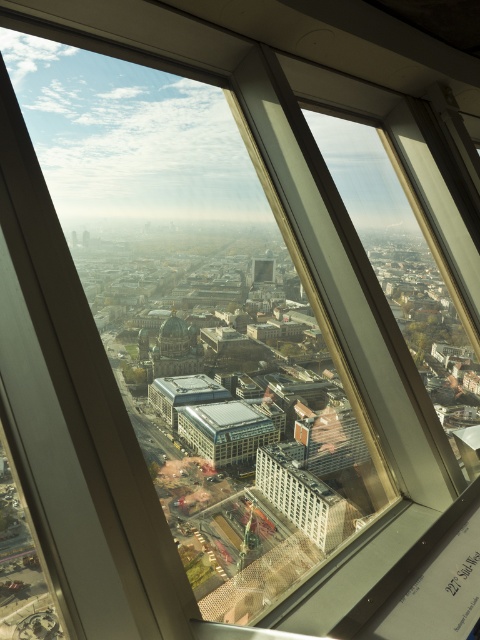
Question: Is white concrete building at center above matte glass building at center?

Choices:
 (A) no
 (B) yes

Answer: (A)

Question: Can you confirm if white concrete building at center is positioned to the right of matte glass building at center?

Choices:
 (A) yes
 (B) no

Answer: (A)

Question: Which of the following is the farthest from the observer?

Choices:
 (A) (278, 460)
 (B) (239, 403)

Answer: (B)

Question: Is white concrete building at center closer to the viewer compared to matte glass building at center?

Choices:
 (A) no
 (B) yes

Answer: (B)

Question: Among these points, which one is farthest from the camera?

Choices:
 (A) (189, 419)
 (B) (298, 500)

Answer: (A)